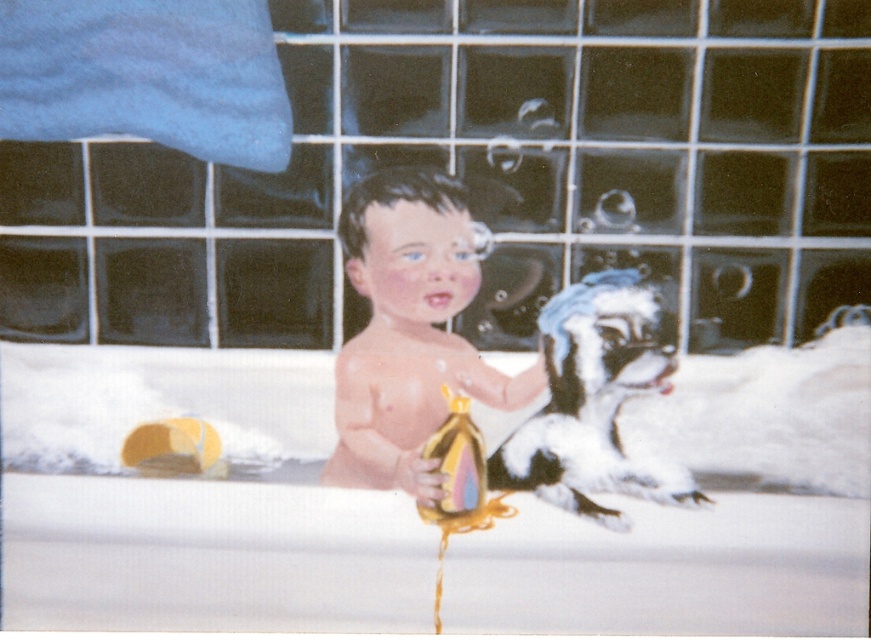
You are a parent looking for your child in the bathroom. You see the white matte bathtub at center and the yellow rubber duck at lower left. Which object is closer to the floor?

The white matte bathtub at center is below the yellow rubber duck at lower left, so the bathtub is closer to the floor.